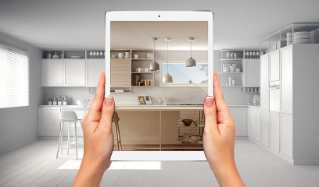
What are the coordinates of `ipad` in the screenshot? It's located at (180, 15).